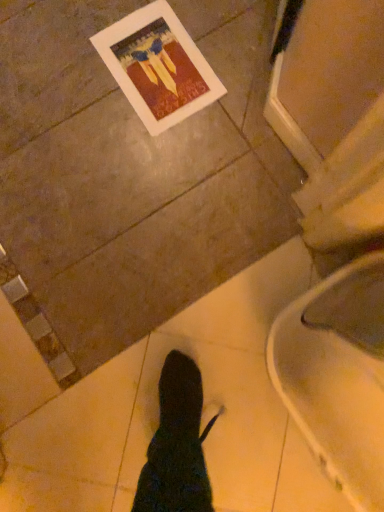
What do you see at coordinates (158, 66) in the screenshot?
I see `matte paper postcard at upper left` at bounding box center [158, 66].

This screenshot has width=384, height=512. What are the coordinates of `matte paper postcard at upper left` in the screenshot? It's located at (158, 66).

Measure the distance between point (119, 45) and camera.

Point (119, 45) is 1.02 meters away from camera.

Where is `white glossy toilet at lower right`? The width and height of the screenshot is (384, 512). white glossy toilet at lower right is located at coordinates (337, 376).

In order to face white glossy toilet at lower right, should I rotate leftwards or rightwards?

You should look right and rotate roughly 26.193 degrees.

The height and width of the screenshot is (512, 384). What do you see at coordinates (337, 376) in the screenshot?
I see `white glossy toilet at lower right` at bounding box center [337, 376].

What is the approximate width of white glossy toilet at lower right?

The width of white glossy toilet at lower right is 34.81 centimeters.

Where is `matte paper postcard at upper left`? The image size is (384, 512). matte paper postcard at upper left is located at coordinates (158, 66).

Is white glossy toilet at lower right at the right side of matte paper postcard at upper left?

Correct, you'll find white glossy toilet at lower right to the right of matte paper postcard at upper left.

Is white glossy toilet at lower right further to camera compared to matte paper postcard at upper left?

No, it is not.

Does point (321, 310) lie in front of point (201, 57)?

That is True.

From the image's perspective, between white glossy toilet at lower right and matte paper postcard at upper left, who is located below?

white glossy toilet at lower right, from the image's perspective.

From a real-world perspective, is white glossy toilet at lower right beneath matte paper postcard at upper left?

Actually, white glossy toilet at lower right is physically above matte paper postcard at upper left in the real world.

Which of these two, white glossy toilet at lower right or matte paper postcard at upper left, is wider?

white glossy toilet at lower right is wider.

Which of these two, white glossy toilet at lower right or matte paper postcard at upper left, stands taller?

white glossy toilet at lower right.

Looking at the image, does white glossy toilet at lower right seem bigger or smaller compared to matte paper postcard at upper left?

Considering their sizes, white glossy toilet at lower right takes up more space than matte paper postcard at upper left.

Is white glossy toilet at lower right inside the boundaries of matte paper postcard at upper left, or outside?

white glossy toilet at lower right is located beyond the bounds of matte paper postcard at upper left.

Are white glossy toilet at lower right and matte paper postcard at upper left making contact?

No, white glossy toilet at lower right is not beside matte paper postcard at upper left.

Is white glossy toilet at lower right positioned with its back to matte paper postcard at upper left?

white glossy toilet at lower right is not turned away from matte paper postcard at upper left.

Can you tell me how much white glossy toilet at lower right and matte paper postcard at upper left differ in facing direction?

The angular difference between white glossy toilet at lower right and matte paper postcard at upper left is 89.5 degrees.

Where is `postcard below the white glossy toilet at lower right (from a real-world perspective)`? Image resolution: width=384 pixels, height=512 pixels. postcard below the white glossy toilet at lower right (from a real-world perspective) is located at coordinates tap(158, 66).

Visually, is matte paper postcard at upper left positioned to the left or to the right of white glossy toilet at lower right?

Based on their positions, matte paper postcard at upper left is located to the left of white glossy toilet at lower right.

Relative to white glossy toilet at lower right, is matte paper postcard at upper left in front or behind?

Visually, matte paper postcard at upper left is located behind white glossy toilet at lower right.

Which is behind, point (169, 81) or point (319, 284)?

The point (169, 81) is behind.

From the image's perspective, which is below, matte paper postcard at upper left or white glossy toilet at lower right?

white glossy toilet at lower right.

From a real-world perspective, relative to white glossy toilet at lower right, is matte paper postcard at upper left vertically above or below?

In terms of real-world spatial position, matte paper postcard at upper left is below white glossy toilet at lower right.

Considering the sizes of objects matte paper postcard at upper left and white glossy toilet at lower right in the image provided, who is wider, matte paper postcard at upper left or white glossy toilet at lower right?

white glossy toilet at lower right is wider.

Who is shorter, matte paper postcard at upper left or white glossy toilet at lower right?

With less height is matte paper postcard at upper left.

Can you confirm if matte paper postcard at upper left is smaller than white glossy toilet at lower right?

Indeed, matte paper postcard at upper left has a smaller size compared to white glossy toilet at lower right.

Is matte paper postcard at upper left not within white glossy toilet at lower right?

Yes.

Is matte paper postcard at upper left far from white glossy toilet at lower right?

No, matte paper postcard at upper left is not far from white glossy toilet at lower right.

Could you tell me if matte paper postcard at upper left is facing white glossy toilet at lower right?

No, matte paper postcard at upper left is not oriented towards white glossy toilet at lower right.

What's the angular difference between matte paper postcard at upper left and white glossy toilet at lower right's facing directions?

A: There is a 89.5-degree angle between the facing directions of matte paper postcard at upper left and white glossy toilet at lower right.

How much distance is there between matte paper postcard at upper left and white glossy toilet at lower right?

A distance of 25.19 inches exists between matte paper postcard at upper left and white glossy toilet at lower right.

You are a GUI agent. You are given a task and a screenshot of the screen. Output one action in this format:
    pyautogui.click(x=<x>, y=<y>)
    Task: Click on the toilet positioned vertically above the matte paper postcard at upper left (from a real-world perspective)
    
    Given the screenshot: What is the action you would take?
    click(x=337, y=376)

In the image, there is a matte paper postcard at upper left. Find the location of `toilet below it (from the image's perspective)`. toilet below it (from the image's perspective) is located at coordinates (337, 376).

In order to click on toilet on the right of matte paper postcard at upper left in this screenshot , I will do pyautogui.click(x=337, y=376).